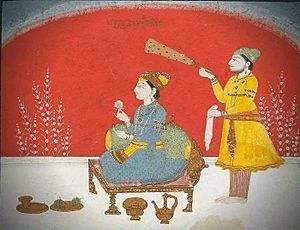
The height and width of the screenshot is (230, 300). In order to click on plates in this screenshot , I will do `click(56, 210)`, `click(38, 208)`.